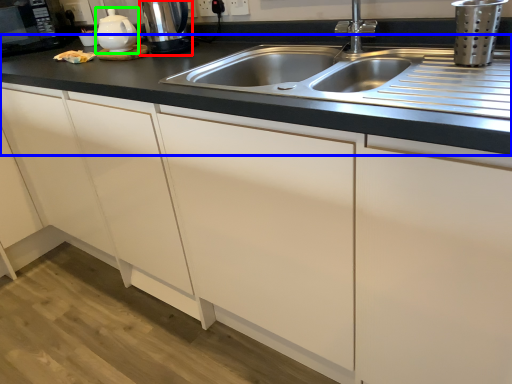
Question: Which is nearer to the coffee machine (highlighted by a red box)? countertop (highlighted by a blue box) or tea pot (highlighted by a green box).

Choices:
 (A) countertop
 (B) tea pot

Answer: (B)